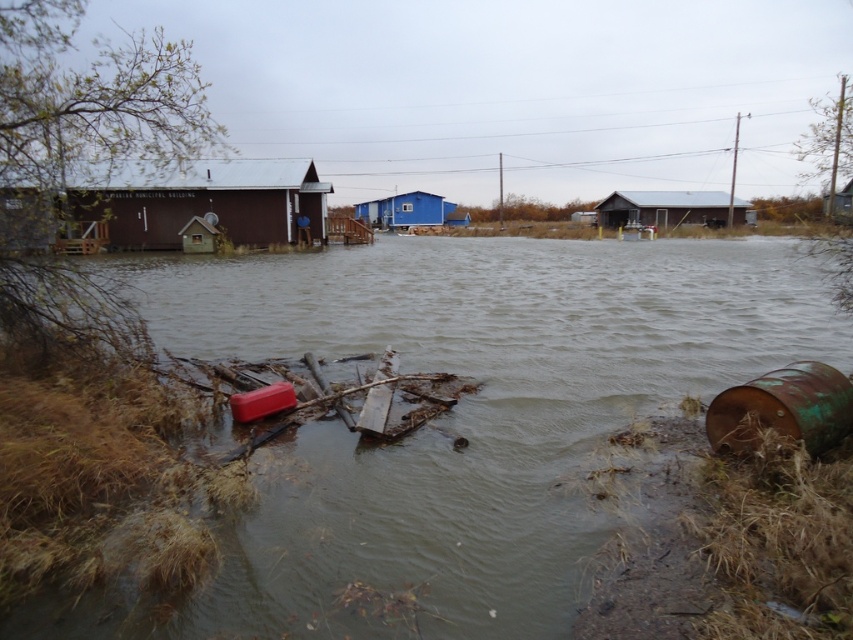
Which is behind, point (798, 384) or point (689, 224)?

Point (689, 224)

Can you confirm if rusty metallic barrel at lower right is thinner than brown corrugated metal hut at center?

Indeed, rusty metallic barrel at lower right has a lesser width compared to brown corrugated metal hut at center.

Is point (759, 412) behind point (624, 196)?

That is False.

Where is `rusty metallic barrel at lower right`? rusty metallic barrel at lower right is located at coordinates (782, 408).

This screenshot has height=640, width=853. What are the coordinates of `rusty metallic barrel at lower right` in the screenshot? It's located at (782, 408).

The width and height of the screenshot is (853, 640). What do you see at coordinates (782, 408) in the screenshot?
I see `rusty metallic barrel at lower right` at bounding box center [782, 408].

Does point (805, 397) come behind point (462, 216)?

No, (805, 397) is closer to viewer.

What are the coordinates of `rusty metallic barrel at lower right` in the screenshot? It's located at (782, 408).

Is brown wooden hut at left bigger than brown corrugated metal hut at center?

No, brown wooden hut at left is not bigger than brown corrugated metal hut at center.

Is brown wooden hut at left positioned at the back of brown corrugated metal hut at center?

No, it is not.

The height and width of the screenshot is (640, 853). What do you see at coordinates (201, 200) in the screenshot?
I see `brown wooden hut at left` at bounding box center [201, 200].

Image resolution: width=853 pixels, height=640 pixels. In order to click on brown wooden hut at left in this screenshot , I will do `click(201, 200)`.